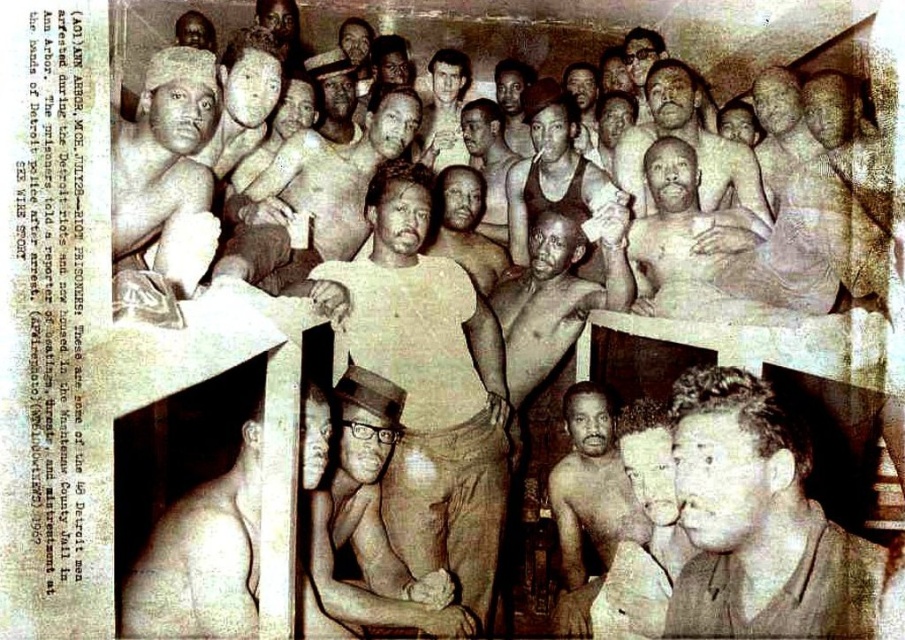
Between smooth black hat at center and fuzzy fabric hat at upper left, which one has more height?

smooth black hat at center

I want to click on smooth black hat at center, so click(x=372, y=524).

Is light beige cotton shirt at center positioned at the back of fuzzy fabric hat at upper left?

That is True.

What do you see at coordinates (431, 388) in the screenshot? I see `light beige cotton shirt at center` at bounding box center [431, 388].

Find the location of a particular element. light beige cotton shirt at center is located at coordinates (431, 388).

Is fuzzy fabric hat at upper left wider than smooth skin face at upper center?

In fact, fuzzy fabric hat at upper left might be narrower than smooth skin face at upper center.

Is fuzzy fabric hat at upper left smaller than smooth skin face at upper center?

Yes, fuzzy fabric hat at upper left is smaller than smooth skin face at upper center.

Describe the element at coordinates (168, 168) in the screenshot. I see `fuzzy fabric hat at upper left` at that location.

The height and width of the screenshot is (640, 905). In order to click on fuzzy fabric hat at upper left in this screenshot , I will do click(168, 168).